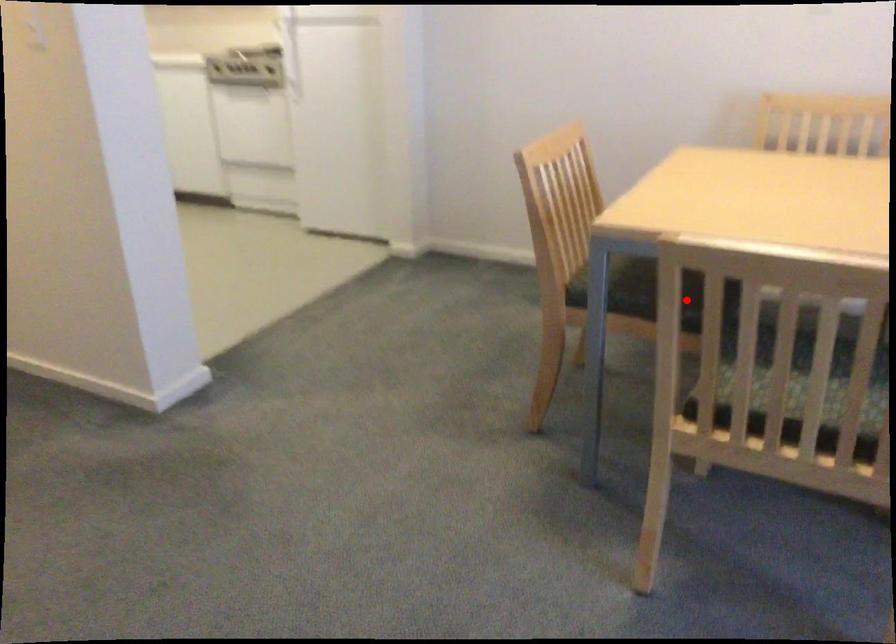
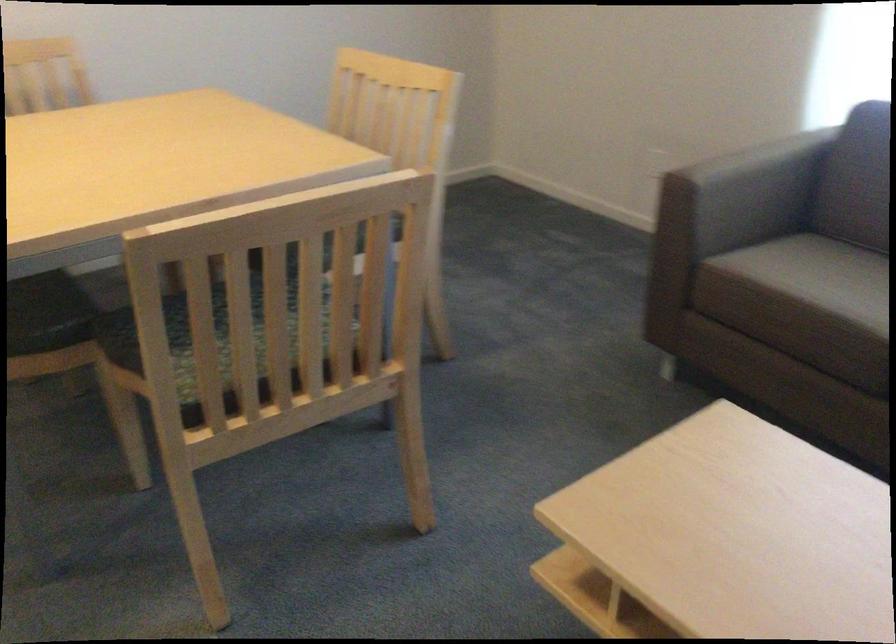
In the second image, find the point that corresponds to the highlighted location in the first image.

(47, 313)